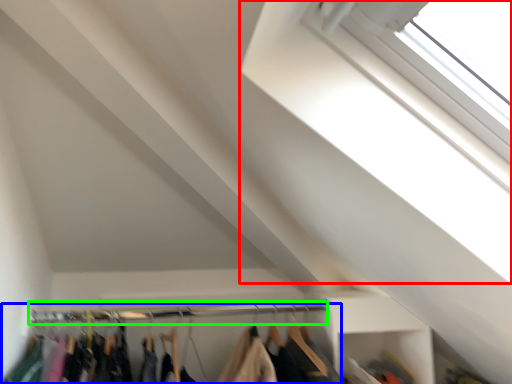
Question: Considering the real-world distances, which object is closest to window (highlighted by a red box)? closet (highlighted by a blue box) or clothesline (highlighted by a green box).

Choices:
 (A) closet
 (B) clothesline

Answer: (B)